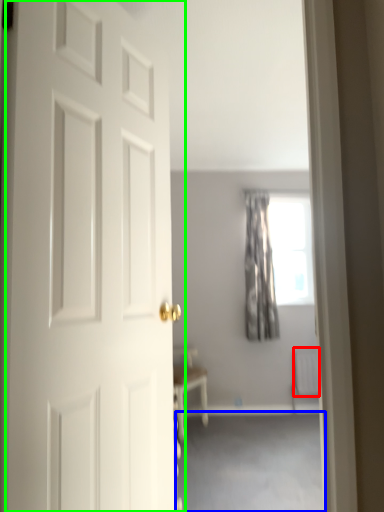
Question: Which object is positioned farthest from radiator (highlighted by a red box)? Select from corridor (highlighted by a blue box) and door (highlighted by a green box).

Choices:
 (A) corridor
 (B) door

Answer: (B)